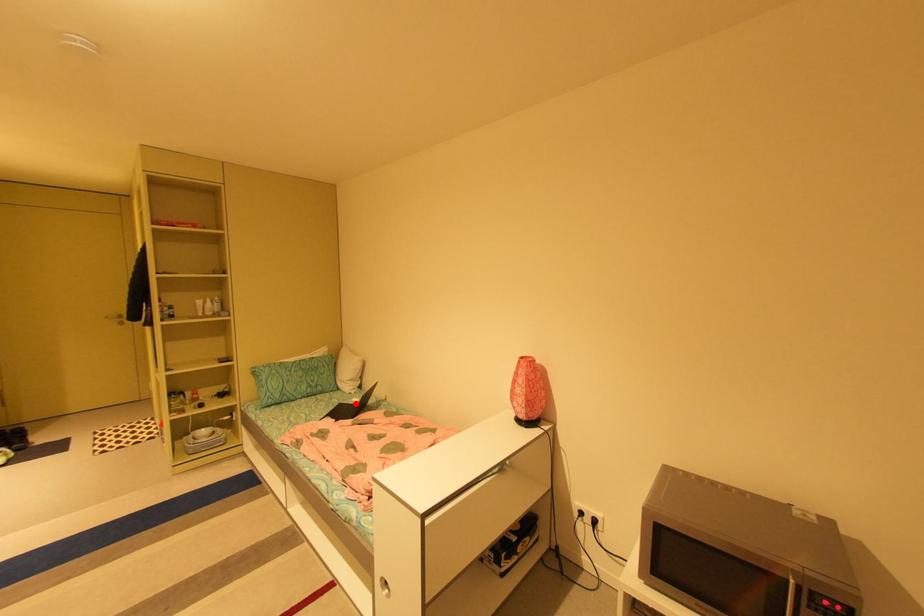
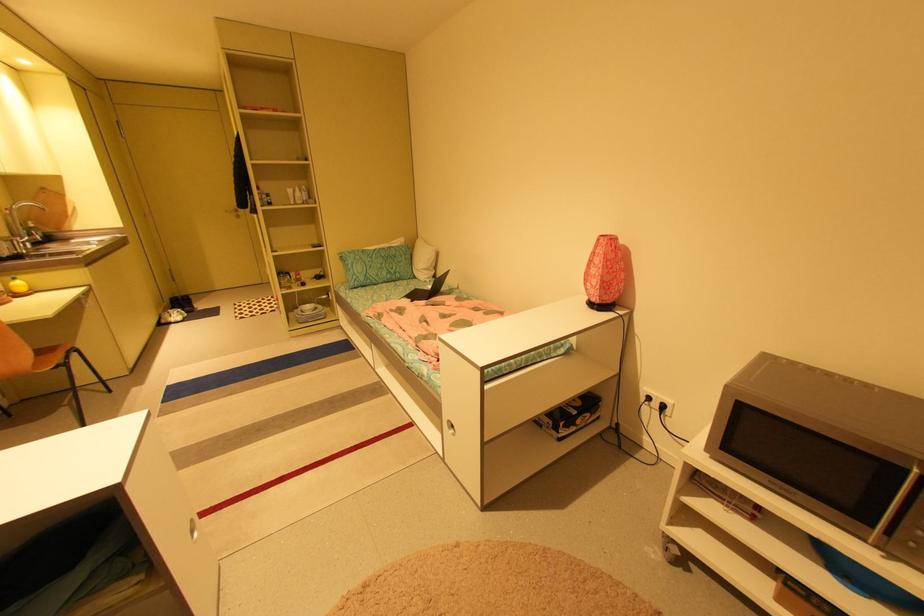
Question: I am providing you with two images of the same scene from different viewpoints. A red point is marked on the first image. Can you still see the location of the red point in image 2?

Choices:
 (A) Yes
 (B) No

Answer: (A)